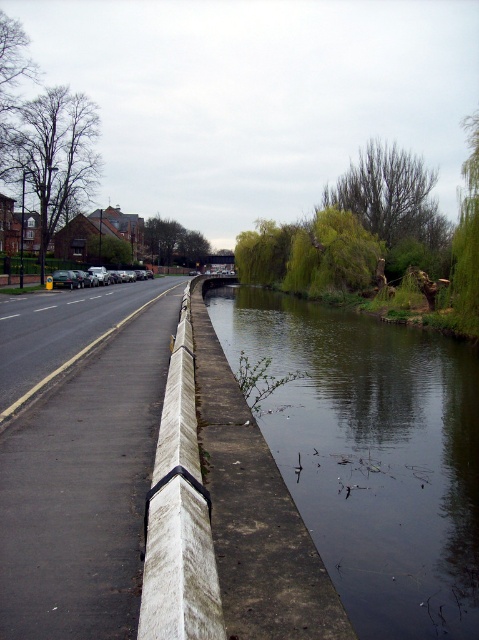
You are standing at the corner of the road and want to locate the dark reflective water at center. According to the coordinates provided, in which direction should you look relative to your position?

The dark reflective water at center is located at coordinates point (372, 454), so you should look towards the lower right direction from your position.

Consider the image. You are a delivery person who needs to cross the road to reach the canal. You see the dark reflective water at center and the white concrete curb at center. Which object should you avoid stepping on to stay safe?

You should avoid stepping on the dark reflective water at center because it is positioned on the right side of the white concrete curb at center, which likely separates the road from the canal. Stepping on the water could be dangerous.